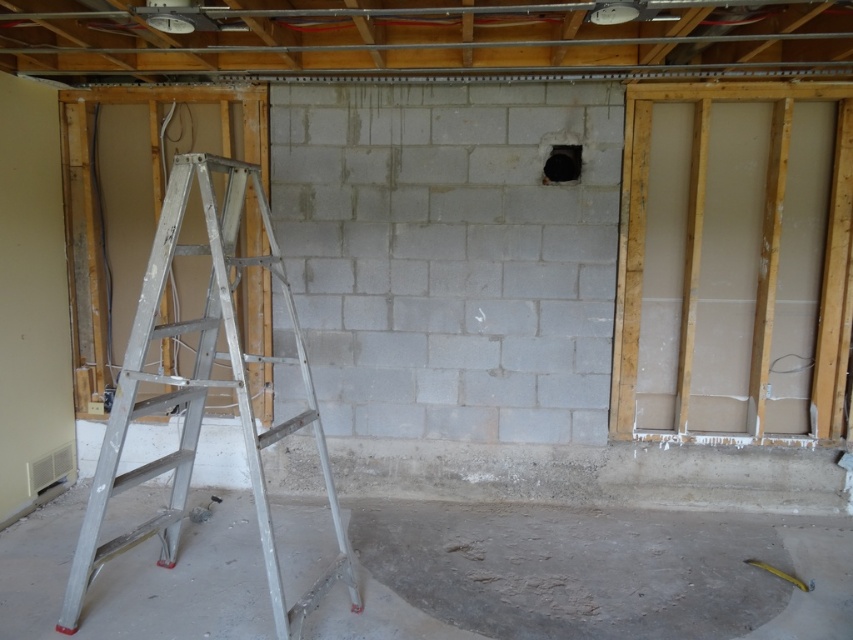
Who is shorter, smooth concrete floor at lower center or silver metallic ladder at left?

smooth concrete floor at lower center is shorter.

This screenshot has width=853, height=640. I want to click on smooth concrete floor at lower center, so click(589, 576).

Where is `smooth concrete floor at lower center`? The height and width of the screenshot is (640, 853). smooth concrete floor at lower center is located at coordinates (589, 576).